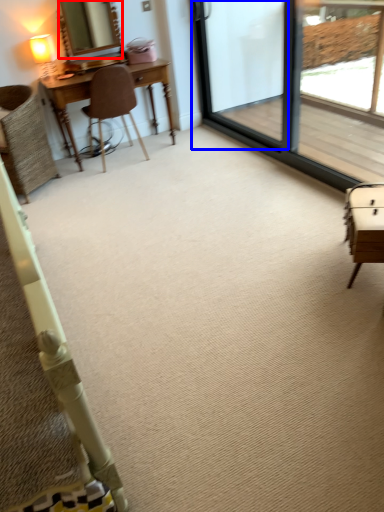
Question: Which point is closer to the camera, mirror (highlighted by a red box) or screen door (highlighted by a blue box)?

Choices:
 (A) mirror
 (B) screen door

Answer: (B)